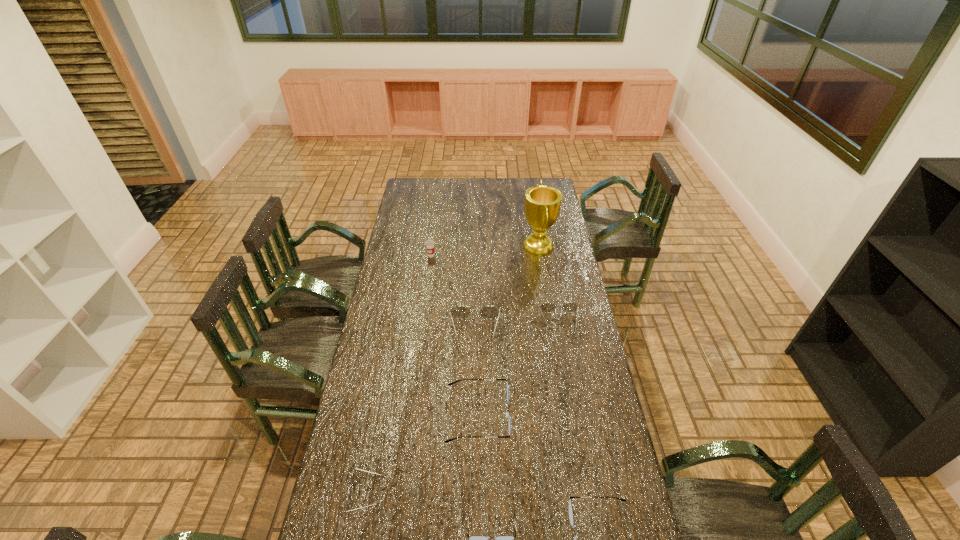
In order to click on spectacles that is at the right edge in this screenshot , I will do `click(547, 307)`.

This screenshot has width=960, height=540. I want to click on blank area at the far edge, so click(451, 186).

In the image, there is a desktop. Where is `vacant space at the left edge`? The width and height of the screenshot is (960, 540). vacant space at the left edge is located at coordinates (408, 274).

In order to click on vacant space at the right edge of the desktop in this screenshot , I will do `click(624, 494)`.

The width and height of the screenshot is (960, 540). Identify the location of blank space at the far left corner of the desktop. (402, 194).

Image resolution: width=960 pixels, height=540 pixels. What are the coordinates of `vacant area that lies between the tallest object and the second smallest yellow spectacles` in the screenshot? It's located at (549, 285).

Locate an element on the screen. Image resolution: width=960 pixels, height=540 pixels. vacant area between the cup and the second biggest yellow spectacles is located at coordinates (495, 289).

This screenshot has width=960, height=540. Find the location of `vacant area that lies between the biggest yellow spectacles and the second tallest object`. vacant area that lies between the biggest yellow spectacles and the second tallest object is located at coordinates (453, 294).

Identify the location of free space between the seventh shortest object and the tallest object. (485, 251).

Identify the location of free space between the nearest yellow spectacles and the rightmost yellow spectacles. This screenshot has width=960, height=540. (463, 408).